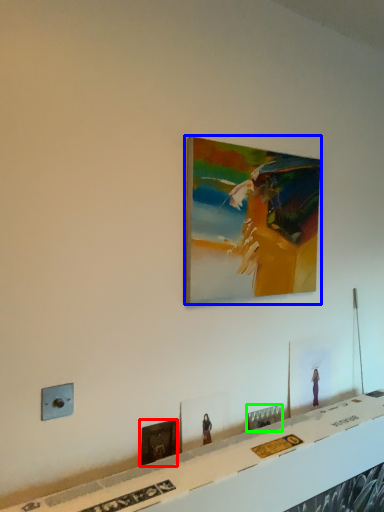
Question: Which is farther away from picture frame (highlighted by a red box)? picture frame (highlighted by a blue box) or picture frame (highlighted by a green box)?

Choices:
 (A) picture frame
 (B) picture frame

Answer: (A)